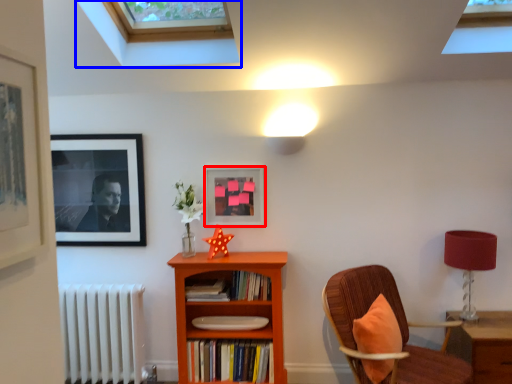
Question: Which point is further to the camera, picture frame (highlighted by a red box) or window (highlighted by a blue box)?

Choices:
 (A) picture frame
 (B) window

Answer: (A)